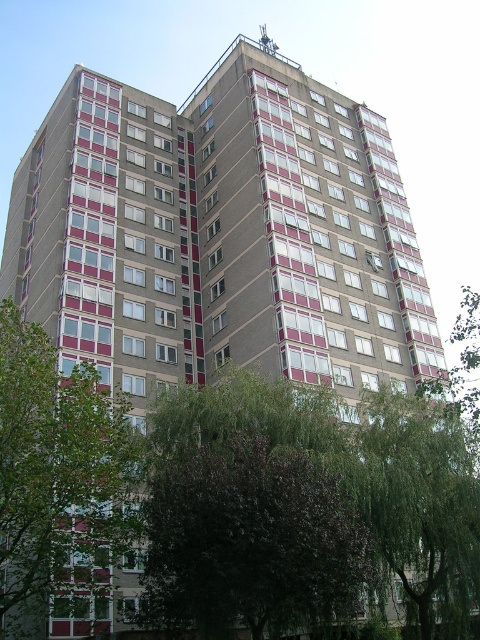
You are standing in front of the residential building and see the dark purple leafy tree at center and the green leafy tree at lower right. Which tree is closer to you?

The dark purple leafy tree at center is closer to you because it is positioned in front of the green leafy tree at lower right.

You are standing in front of the residential building and notice two trees nearby. The dark purple leafy tree at center and the green leafy tree at left. Which tree is closer to you?

The dark purple leafy tree at center is closer to the viewer than the green leafy tree at left.

You are standing in front of the residential building and notice two trees in the image. Which tree, the dark purple leafy tree at center or the green leafy tree at lower right, is located to the left of the other?

The dark purple leafy tree at center is positioned on the left side of green leafy tree at lower right.